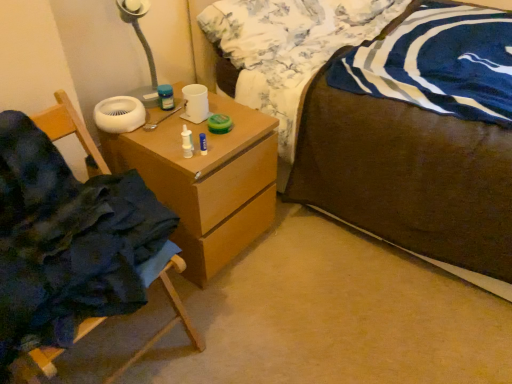
Question: Should I look upward or downward to see wooden chair at left?

Choices:
 (A) up
 (B) down

Answer: (B)

Question: Are brown wooden bed at center and wooden chest of drawers at center beside each other?

Choices:
 (A) yes
 (B) no

Answer: (B)

Question: Does brown wooden bed at center lie behind wooden chest of drawers at center?

Choices:
 (A) no
 (B) yes

Answer: (A)

Question: Is brown wooden bed at center to the right of wooden chest of drawers at center from the viewer's perspective?

Choices:
 (A) yes
 (B) no

Answer: (A)

Question: Is brown wooden bed at center bigger than wooden chest of drawers at center?

Choices:
 (A) yes
 (B) no

Answer: (A)

Question: From a real-world perspective, is brown wooden bed at center below wooden chest of drawers at center?

Choices:
 (A) yes
 (B) no

Answer: (B)

Question: Is brown wooden bed at center closer to camera compared to wooden chest of drawers at center?

Choices:
 (A) yes
 (B) no

Answer: (A)

Question: Is fluffy white pillow at upper center shorter than brown wooden bed at center?

Choices:
 (A) no
 (B) yes

Answer: (B)

Question: From the image's perspective, is fluffy white pillow at upper center located beneath brown wooden bed at center?

Choices:
 (A) yes
 (B) no

Answer: (B)

Question: Is fluffy white pillow at upper center positioned behind brown wooden bed at center?

Choices:
 (A) no
 (B) yes

Answer: (B)

Question: Considering the relative positions of fluffy white pillow at upper center and brown wooden bed at center in the image provided, is fluffy white pillow at upper center to the left of brown wooden bed at center from the viewer's perspective?

Choices:
 (A) yes
 (B) no

Answer: (A)

Question: Does fluffy white pillow at upper center have a greater width compared to brown wooden bed at center?

Choices:
 (A) no
 (B) yes

Answer: (A)

Question: Is fluffy white pillow at upper center positioned with its back to brown wooden bed at center?

Choices:
 (A) no
 (B) yes

Answer: (B)

Question: Considering the relative sizes of fluffy white pillow at upper center and wooden chest of drawers at center in the image provided, is fluffy white pillow at upper center thinner than wooden chest of drawers at center?

Choices:
 (A) no
 (B) yes

Answer: (B)